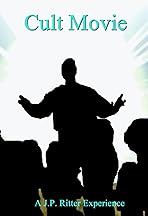
What are the coordinates of `corners` in the screenshot? It's located at (0, 0), (147, 215).